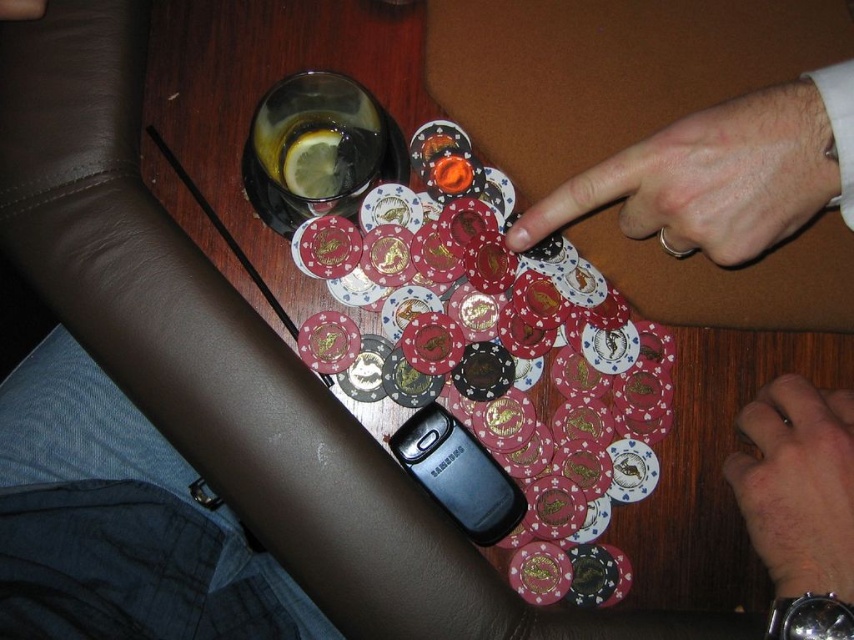
Question: Can you confirm if smooth skin finger at upper right is thinner than smooth skin hand at lower right?

Choices:
 (A) yes
 (B) no

Answer: (B)

Question: Which is farther from the metallic blue phone at center?

Choices:
 (A) smooth skin hand at lower right
 (B) smooth skin finger at upper right

Answer: (B)

Question: Considering the real-world distances, which object is farthest from the smooth skin hand at lower right?

Choices:
 (A) smooth skin finger at upper right
 (B) metallic blue phone at center

Answer: (B)

Question: Which of the following is the farthest from the observer?

Choices:
 (A) (126, 412)
 (B) (812, 557)
 (C) (782, 177)

Answer: (A)

Question: Can you confirm if smooth skin finger at upper right is smaller than smooth skin hand at lower right?

Choices:
 (A) no
 (B) yes

Answer: (A)

Question: From the image, what is the correct spatial relationship of metallic blue phone at center in relation to smooth skin finger at upper right?

Choices:
 (A) below
 (B) above

Answer: (A)